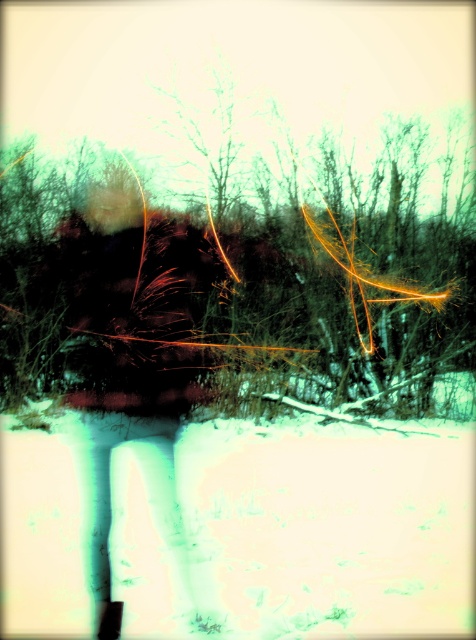
Does smooth brown tree trunk at center have a smaller size compared to white powdery snow at lower center?

No, smooth brown tree trunk at center is not smaller than white powdery snow at lower center.

The image size is (476, 640). Find the location of `smooth brown tree trunk at center`. smooth brown tree trunk at center is located at coordinates click(235, 276).

I want to click on smooth brown tree trunk at center, so click(235, 276).

Which is in front, point (339, 448) or point (90, 330)?

Point (90, 330) is more forward.

The image size is (476, 640). What are the coordinates of `white powdery snow at lower center` in the screenshot? It's located at (241, 528).

You are a GUI agent. You are given a task and a screenshot of the screen. Output one action in this format:
    pyautogui.click(x=<x>, y=<y>)
    Task: Click on the white powdery snow at lower center
    
    Given the screenshot: What is the action you would take?
    pyautogui.click(x=241, y=528)

Does point (427, 330) come closer to viewer compared to point (176, 346)?

That is False.

Is point (218, 154) behind point (132, 332)?

Yes.

At what (x,y) coordinates should I click in order to perform the action: click on smooth brown tree trunk at center. Please return your answer as a coordinate pair (x, y). This screenshot has height=640, width=476. Looking at the image, I should click on (235, 276).